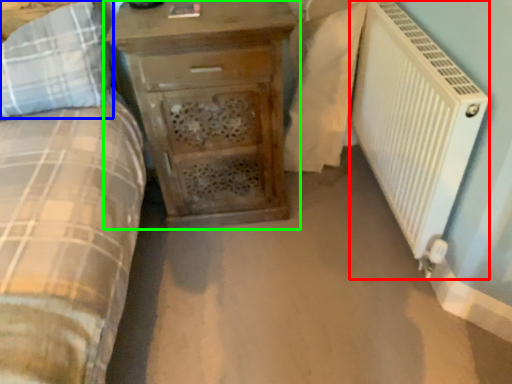
Question: Considering the real-world distances, which object is farthest from radiator (highlighted by a red box)? pillow (highlighted by a blue box) or chest of drawers (highlighted by a green box)?

Choices:
 (A) pillow
 (B) chest of drawers

Answer: (A)